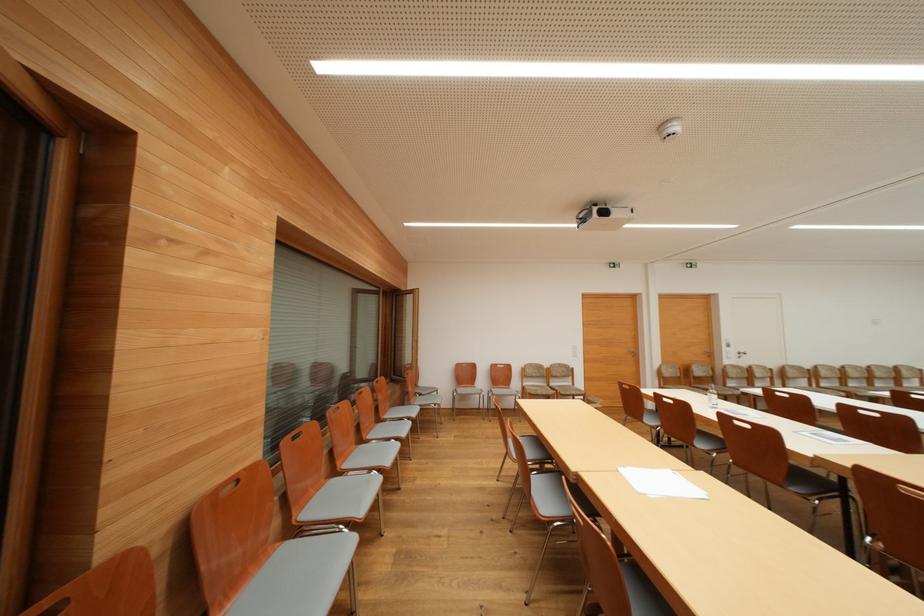
Find where to turn the window handle. Please return your answer as a coordinate pair (x, y).

(740, 353)